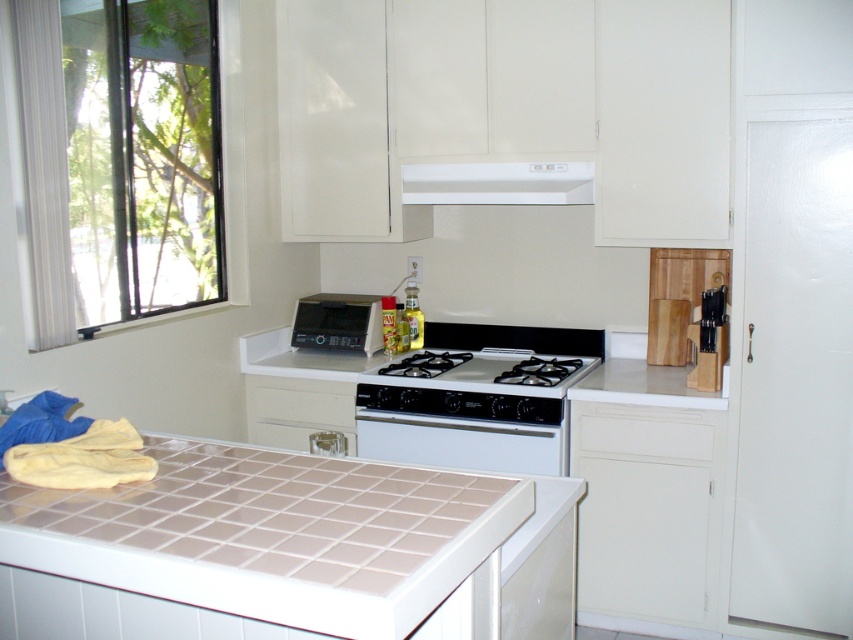
Question: Estimate the real-world distances between objects in this image. Which object is closer to the white glossy gas stove at center?

Choices:
 (A) clear glass window at upper left
 (B) matte black microwave at center

Answer: (B)

Question: Among these points, which one is nearest to the camera?

Choices:
 (A) (x=161, y=60)
 (B) (x=344, y=301)

Answer: (A)

Question: Which is farther from the white matte exhaust hood at upper center?

Choices:
 (A) beige tile countertop at lower center
 (B) matte black microwave at center
 (C) white glossy oven at center

Answer: (A)

Question: Does white glossy oven at center appear on the right side of white glossy gas stove at center?

Choices:
 (A) yes
 (B) no

Answer: (B)

Question: Does clear glass window at upper left appear on the right side of white glossy oven at center?

Choices:
 (A) yes
 (B) no

Answer: (B)

Question: Does clear glass window at upper left have a larger size compared to white matte exhaust hood at upper center?

Choices:
 (A) yes
 (B) no

Answer: (A)